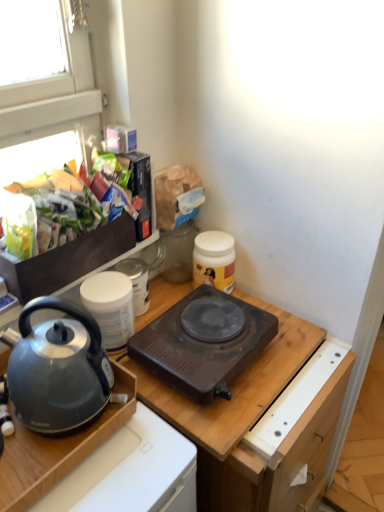
Question: Considering the relative sizes of white matte container at upper left, arranged as the 3th kitchen appliance when viewed from the right, and yellow matte jar at upper right, which appears as the 3th kitchen appliance when viewed from the left, in the image provided, is white matte container at upper left, arranged as the 3th kitchen appliance when viewed from the right, taller than yellow matte jar at upper right, which appears as the 3th kitchen appliance when viewed from the left,?

Choices:
 (A) yes
 (B) no

Answer: (B)

Question: Is yellow matte jar at upper right, which ranks as the first kitchen appliance in right-to-left order, at the back of white matte container at upper left, arranged as the 3th kitchen appliance when viewed from the right?

Choices:
 (A) no
 (B) yes

Answer: (A)

Question: Can you confirm if white matte container at upper left, arranged as the 3th kitchen appliance when viewed from the right, is bigger than yellow matte jar at upper right, which ranks as the first kitchen appliance in right-to-left order?

Choices:
 (A) yes
 (B) no

Answer: (A)

Question: Is white matte container at upper left, arranged as the first kitchen appliance when viewed from the left, outside yellow matte jar at upper right, which ranks as the first kitchen appliance in right-to-left order?

Choices:
 (A) no
 (B) yes

Answer: (B)

Question: Is the surface of white matte container at upper left, arranged as the first kitchen appliance when viewed from the left, in direct contact with yellow matte jar at upper right, which appears as the 3th kitchen appliance when viewed from the left?

Choices:
 (A) yes
 (B) no

Answer: (B)

Question: In the image, is dark brown plastic hot plate at center, arranged as the second kitchen appliance when viewed from the left, on the left side or the right side of white matte container at upper left, arranged as the first kitchen appliance when viewed from the left?

Choices:
 (A) right
 (B) left

Answer: (A)

Question: Is dark brown plastic hot plate at center, arranged as the second kitchen appliance when viewed from the left, in front of or behind white matte container at upper left, arranged as the 3th kitchen appliance when viewed from the right, in the image?

Choices:
 (A) behind
 (B) front

Answer: (B)

Question: Would you say dark brown plastic hot plate at center, positioned as the second kitchen appliance in right-to-left order, is inside or outside white matte container at upper left, arranged as the first kitchen appliance when viewed from the left?

Choices:
 (A) inside
 (B) outside

Answer: (B)

Question: From a real-world perspective, relative to white matte container at upper left, arranged as the first kitchen appliance when viewed from the left, is dark brown plastic hot plate at center, arranged as the second kitchen appliance when viewed from the left, vertically above or below?

Choices:
 (A) below
 (B) above

Answer: (A)

Question: From their relative heights in the image, would you say dark brown plastic hot plate at center, arranged as the second kitchen appliance when viewed from the left, is taller or shorter than shiny plastic bag of chips at upper left?

Choices:
 (A) short
 (B) tall

Answer: (A)

Question: Looking at their shapes, would you say dark brown plastic hot plate at center, arranged as the second kitchen appliance when viewed from the left, is wider or thinner than shiny plastic bag of chips at upper left?

Choices:
 (A) wide
 (B) thin

Answer: (A)

Question: Considering the positions of dark brown plastic hot plate at center, positioned as the second kitchen appliance in right-to-left order, and shiny plastic bag of chips at upper left in the image, is dark brown plastic hot plate at center, positioned as the second kitchen appliance in right-to-left order, bigger or smaller than shiny plastic bag of chips at upper left?

Choices:
 (A) big
 (B) small

Answer: (B)

Question: Considering their positions, is dark brown plastic hot plate at center, arranged as the second kitchen appliance when viewed from the left, located in front of or behind shiny plastic bag of chips at upper left?

Choices:
 (A) behind
 (B) front

Answer: (A)

Question: Looking at the image, does dark brown plastic hot plate at center, arranged as the second kitchen appliance when viewed from the left, seem bigger or smaller compared to matte gray kettle at left?

Choices:
 (A) small
 (B) big

Answer: (A)

Question: Is dark brown plastic hot plate at center, positioned as the second kitchen appliance in right-to-left order, inside or outside of matte gray kettle at left?

Choices:
 (A) inside
 (B) outside

Answer: (B)